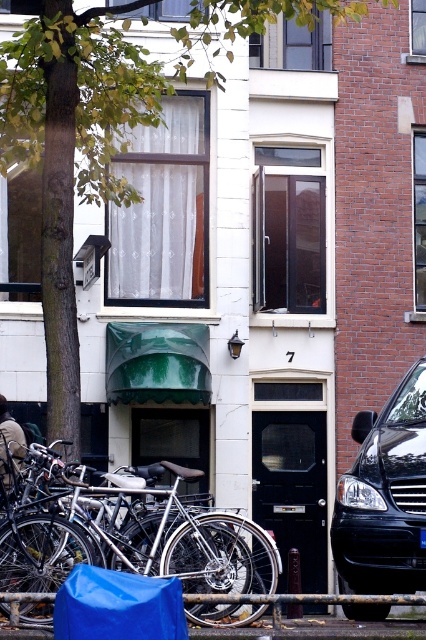
Find the location of a particular element. silver metallic bicycle at center is located at coordinates (126, 531).

Does silver metallic bicycle at center have a greater height compared to black glossy van at lower right?

No, silver metallic bicycle at center is not taller than black glossy van at lower right.

Measure the distance between silver metallic bicycle at center and camera.

silver metallic bicycle at center and camera are 8.64 meters apart.

At what (x,y) coordinates should I click in order to perform the action: click on silver metallic bicycle at center. Please return your answer as a coordinate pair (x, y). Looking at the image, I should click on (126, 531).

Between black glossy van at lower right and blue tarp at lower left, which one is positioned higher?

Positioned higher is black glossy van at lower right.

In the scene shown: Can you confirm if black glossy van at lower right is bigger than blue tarp at lower left?

Correct, black glossy van at lower right is larger in size than blue tarp at lower left.

Between point (397, 467) and point (68, 602), which one is positioned in front?

Point (68, 602)

Identify the location of black glossy van at lower right. This screenshot has height=640, width=426. (385, 497).

Who is more forward, (117, 564) or (63, 609)?

Point (63, 609)

Between silver metallic bicycle at center and blue tarp at lower left, which one has more height?

Standing taller between the two is silver metallic bicycle at center.

Where is `silver metallic bicycle at center`? The image size is (426, 640). silver metallic bicycle at center is located at coordinates (126, 531).

Find the location of `silver metallic bicycle at center`. silver metallic bicycle at center is located at coordinates (126, 531).